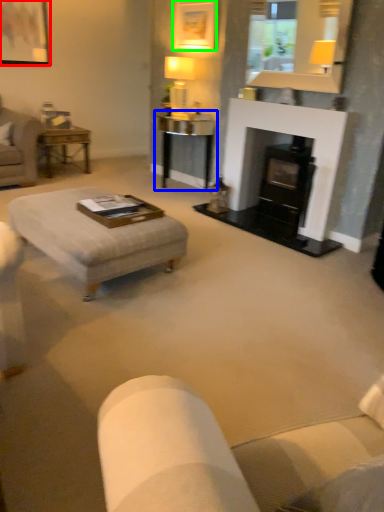
Question: Which object is the farthest from picture frame (highlighted by a red box)? Choose among these: table (highlighted by a blue box) or picture frame (highlighted by a green box).

Choices:
 (A) table
 (B) picture frame

Answer: (A)